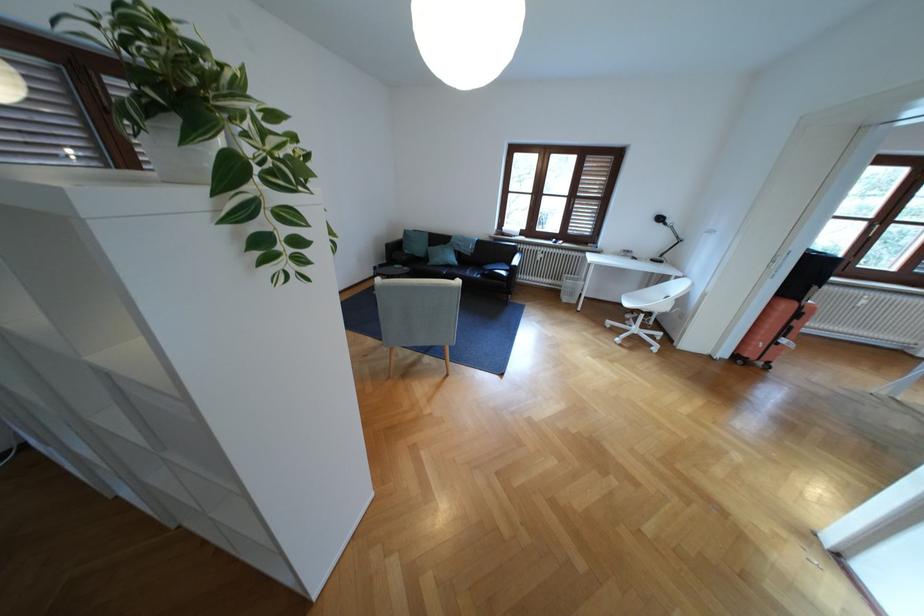
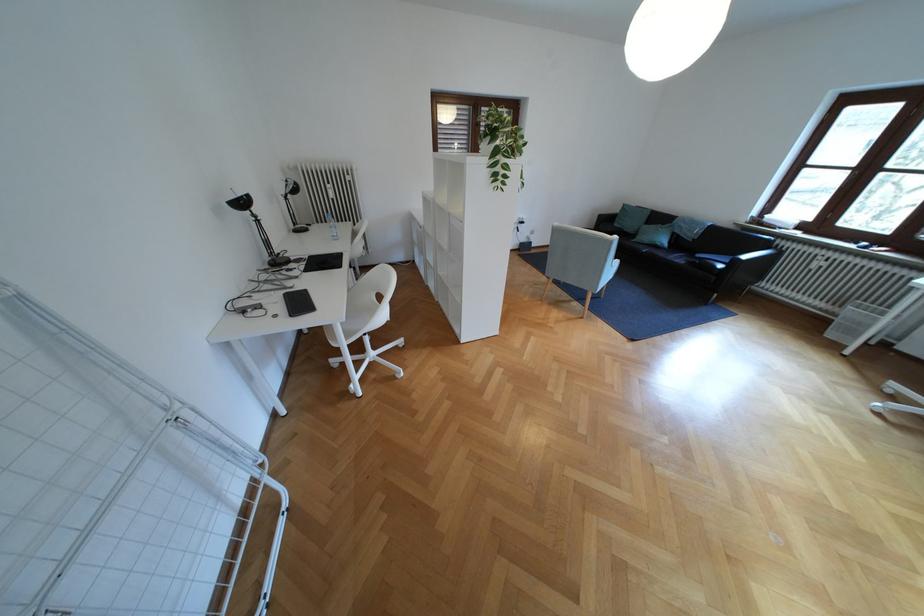
Locate, in the second image, the point that corresponds to point 526,262 in the first image.

(757, 257)